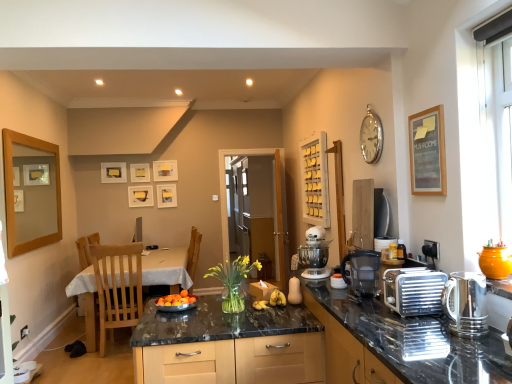
Question: Should I look upward or downward to see white matte mixer at center?

Choices:
 (A) down
 (B) up

Answer: (A)

Question: Is wooden picture frame at left, which ranks as the seventh picture frame in right-to-left order, thinner than light wood chair at left, the second chair in the back-to-front sequence?

Choices:
 (A) no
 (B) yes

Answer: (B)

Question: Are wooden picture frame at left, the second picture frame from the front, and light wood chair at left, the first chair when ordered from front to back, making contact?

Choices:
 (A) no
 (B) yes

Answer: (A)

Question: Does wooden picture frame at left, the second picture frame from the front, have a larger size compared to light wood chair at left, the first chair when ordered from front to back?

Choices:
 (A) no
 (B) yes

Answer: (A)

Question: Is wooden picture frame at left, the second picture frame from the front, not within light wood chair at left, the first chair when ordered from front to back?

Choices:
 (A) no
 (B) yes

Answer: (B)

Question: Does wooden picture frame at left, the 1th picture frame viewed from the left, have a greater width compared to light wood chair at left, the first chair when ordered from front to back?

Choices:
 (A) yes
 (B) no

Answer: (B)

Question: From the image's perspective, is wooden picture frame at left, the second picture frame from the front, on light wood chair at left, the first chair when ordered from front to back?

Choices:
 (A) yes
 (B) no

Answer: (A)

Question: From the image's perspective, is shiny granite countertop at center located beneath black plastic water filter at center, the second kitchen appliance positioned from the front?

Choices:
 (A) yes
 (B) no

Answer: (A)

Question: Is shiny granite countertop at center positioned before black plastic water filter at center, placed as the first kitchen appliance when sorted from left to right?

Choices:
 (A) no
 (B) yes

Answer: (B)

Question: From a real-world perspective, is shiny granite countertop at center on black plastic water filter at center, which appears as the 2th kitchen appliance when viewed from the right?

Choices:
 (A) no
 (B) yes

Answer: (A)

Question: Can you confirm if shiny granite countertop at center is shorter than black plastic water filter at center, acting as the 1th kitchen appliance starting from the back?

Choices:
 (A) no
 (B) yes

Answer: (A)

Question: Can you confirm if shiny granite countertop at center is positioned to the left of black plastic water filter at center, placed as the first kitchen appliance when sorted from left to right?

Choices:
 (A) no
 (B) yes

Answer: (A)

Question: Is black plastic water filter at center, placed as the first kitchen appliance when sorted from left to right, at the back of shiny granite countertop at center?

Choices:
 (A) yes
 (B) no

Answer: (B)

Question: Is white glossy table at lower left bigger than black plastic water filter at center, placed as the first kitchen appliance when sorted from left to right?

Choices:
 (A) no
 (B) yes

Answer: (B)